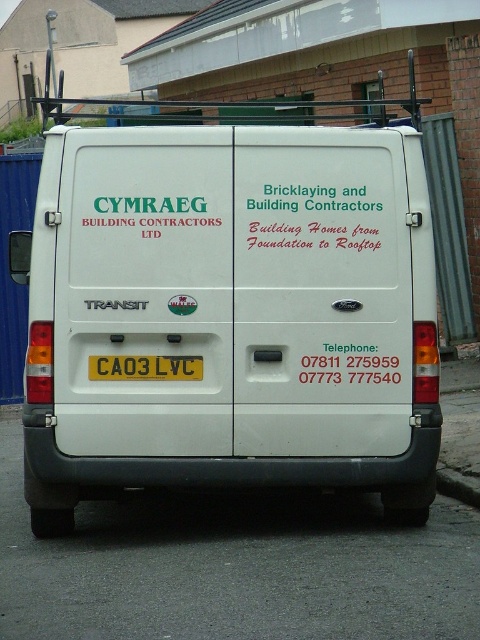
Question: Does white matte van at center appear on the left side of yellow matte license plate at center?

Choices:
 (A) yes
 (B) no

Answer: (B)

Question: Observing the image, what is the correct spatial positioning of yellow matte license plate at center in reference to gray concrete curb at lower right?

Choices:
 (A) below
 (B) above

Answer: (B)

Question: Estimate the real-world distances between objects in this image. Which object is closer to the gray concrete curb at lower right?

Choices:
 (A) white matte van at center
 (B) yellow matte license plate at center

Answer: (A)

Question: Is white matte van at center thinner than gray concrete curb at lower right?

Choices:
 (A) yes
 (B) no

Answer: (B)

Question: Which of the following is the closest to the observer?

Choices:
 (A) (157, 368)
 (B) (184, 232)
 (C) (465, 490)

Answer: (B)

Question: Which object is positioned farthest from the gray concrete curb at lower right?

Choices:
 (A) yellow matte license plate at center
 (B) white matte van at center

Answer: (A)